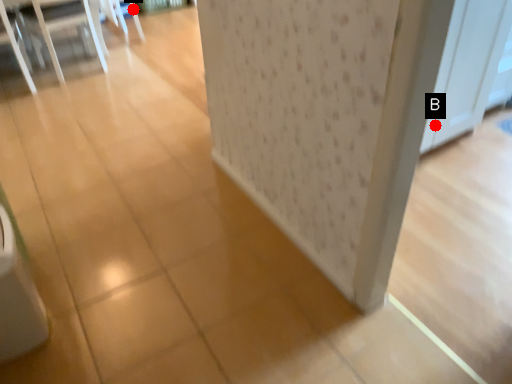
Question: Two points are circled on the image, labeled by A and B beside each circle. Which of the following is the closest to the observer?

Choices:
 (A) A is closer
 (B) B is closer

Answer: (B)